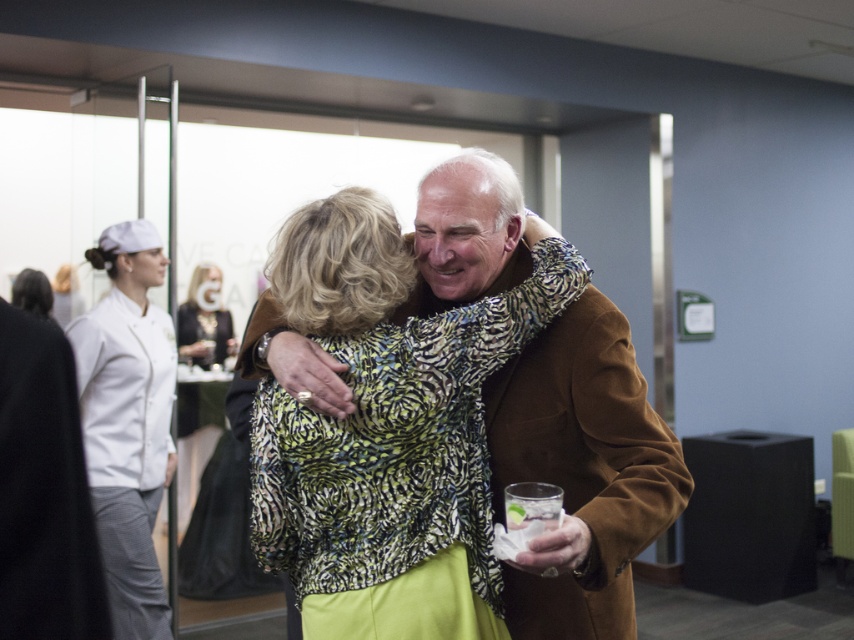
Question: Is brown wool coat at center wider than black satin dress at center?

Choices:
 (A) no
 (B) yes

Answer: (B)

Question: Which is nearer to the white chef's uniform at left?

Choices:
 (A) black satin dress at center
 (B) brown wool coat at center

Answer: (A)

Question: Where is white chef's uniform at left located in relation to black satin dress at center in the image?

Choices:
 (A) below
 (B) above

Answer: (A)

Question: Considering the relative positions of brown wool coat at center and white chef's uniform at left in the image provided, where is brown wool coat at center located with respect to white chef's uniform at left?

Choices:
 (A) above
 (B) below

Answer: (A)

Question: Which is nearer to the brown wool coat at center?

Choices:
 (A) black satin dress at center
 (B) white chef's uniform at left

Answer: (B)

Question: Among these points, which one is farthest from the camera?

Choices:
 (A) click(x=194, y=496)
 (B) click(x=502, y=378)
 (C) click(x=126, y=344)

Answer: (A)